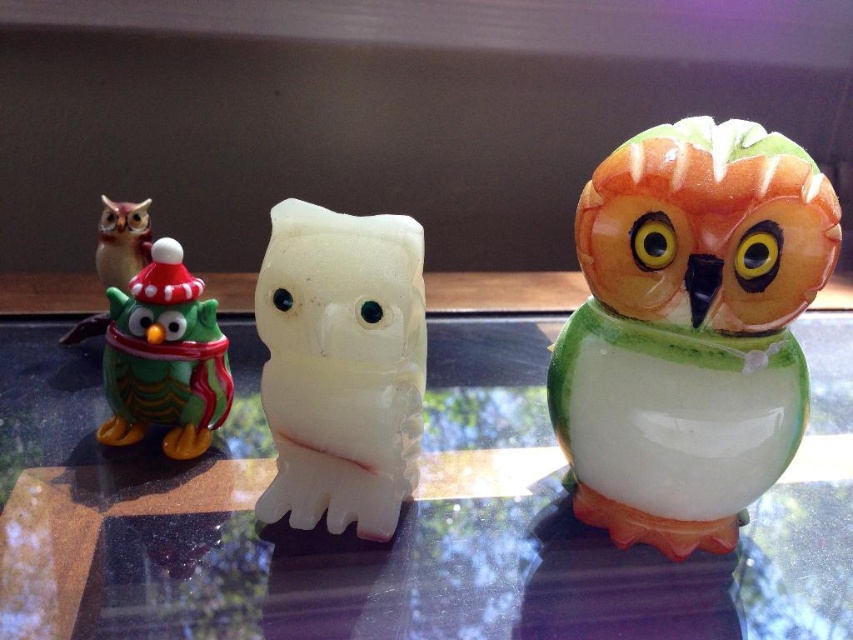
Which of these two, matte orange owl at right or white glossy owl at center, stands shorter?

Standing shorter between the two is white glossy owl at center.

Is point (804, 198) positioned behind point (299, 461)?

That is False.

Image resolution: width=853 pixels, height=640 pixels. I want to click on matte orange owl at right, so click(689, 330).

Image resolution: width=853 pixels, height=640 pixels. I want to click on matte orange owl at right, so pos(689,330).

Which is above, transparent glass table at center or matte orange owl at right?

matte orange owl at right

Between transparent glass table at center and matte orange owl at right, which one has more height?

matte orange owl at right

Does point (241, 445) lie behind point (602, 168)?

Yes.

Where is `transparent glass table at center`? The image size is (853, 640). transparent glass table at center is located at coordinates tap(399, 518).

Does white glossy owl at center have a lesser width compared to matte green owl at left?

In fact, white glossy owl at center might be wider than matte green owl at left.

Find the location of a particular element. The image size is (853, 640). white glossy owl at center is located at coordinates (341, 365).

What are the coordinates of `white glossy owl at center` in the screenshot? It's located at (341, 365).